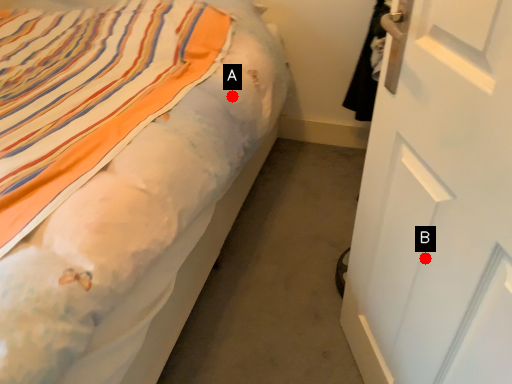
Question: Two points are circled on the image, labeled by A and B beside each circle. Among these points, which one is nearest to the camera?

Choices:
 (A) A is closer
 (B) B is closer

Answer: (B)